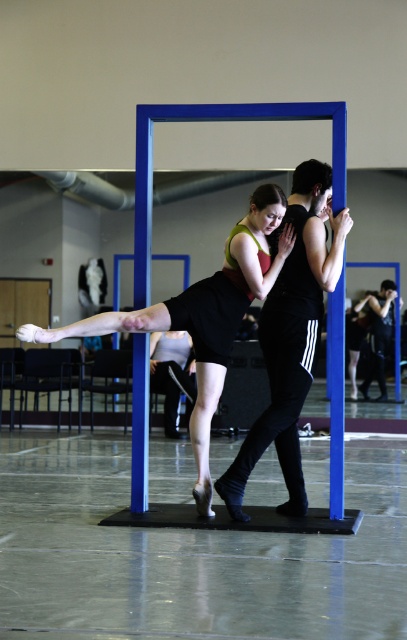
Question: Which of these objects is positioned farthest from the dark blue jeans at center?

Choices:
 (A) black satin skirt at center
 (B) black matte pants at center

Answer: (A)

Question: Which of these objects is positioned farthest from the black satin skirt at center?

Choices:
 (A) black matte pants at center
 (B) dark blue jeans at center

Answer: (B)

Question: Is black matte pants at center below dark blue jeans at center?

Choices:
 (A) no
 (B) yes

Answer: (A)

Question: Does black matte pants at center have a smaller size compared to dark blue jeans at center?

Choices:
 (A) no
 (B) yes

Answer: (A)

Question: Does black matte pants at center appear under dark blue jeans at center?

Choices:
 (A) no
 (B) yes

Answer: (A)

Question: Which object is closer to the camera taking this photo?

Choices:
 (A) dark blue jeans at center
 (B) black matte pants at center
 (C) black satin skirt at center

Answer: (B)